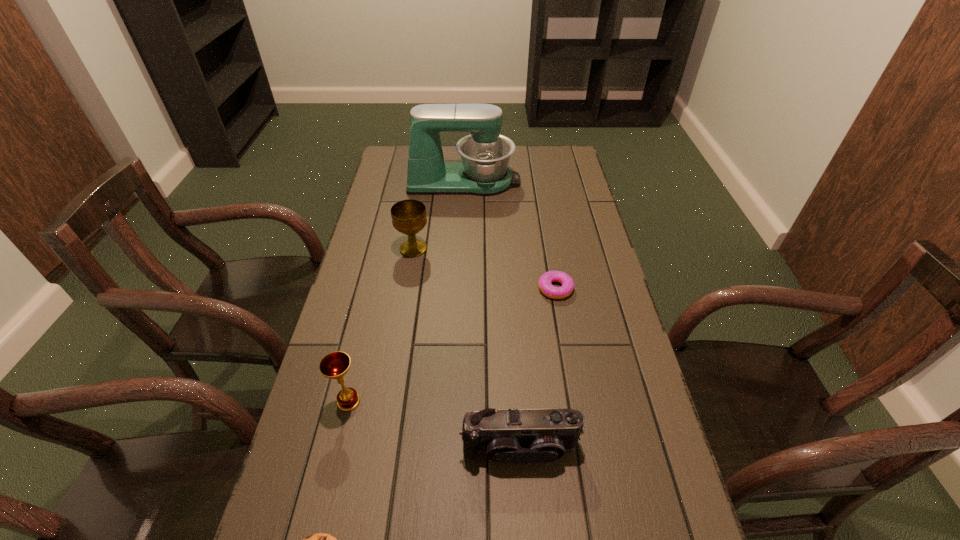
Select which object appears as the fifth closest to the shortest object. Please provide its 2D coordinates. Your answer should be formatted as a tuple, i.e. [(x, y)], where the tuple contains the x and y coordinates of a point satisfying the conditions above.

[(485, 154)]

You are a GUI agent. You are given a task and a screenshot of the screen. Output one action in this format:
    pyautogui.click(x=<x>, y=<y>)
    Task: Click on the vacant space that satisfies the following two spatial constraints: 1. on the back side of the nearer chalice; 2. on the right side of the third farthest object
    The height and width of the screenshot is (540, 960).
    Given the screenshot: What is the action you would take?
    tap(375, 288)

Identify the location of vacant space that satisfies the following two spatial constraints: 1. on the front-facing side of the farthest object; 2. on the front side of the fifth nearest object. The height and width of the screenshot is (540, 960). (461, 249).